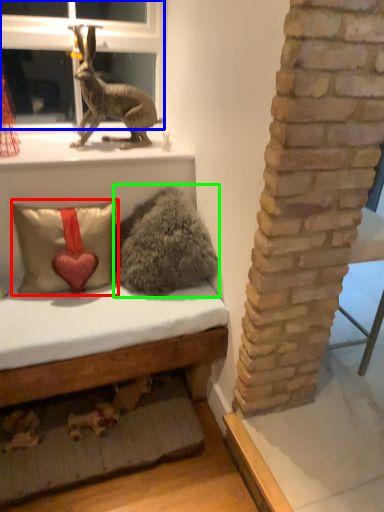
Question: Considering the real-world distances, which object is farthest from pillow (highlighted by a red box)? bay window (highlighted by a blue box) or animal (highlighted by a green box)?

Choices:
 (A) bay window
 (B) animal

Answer: (A)